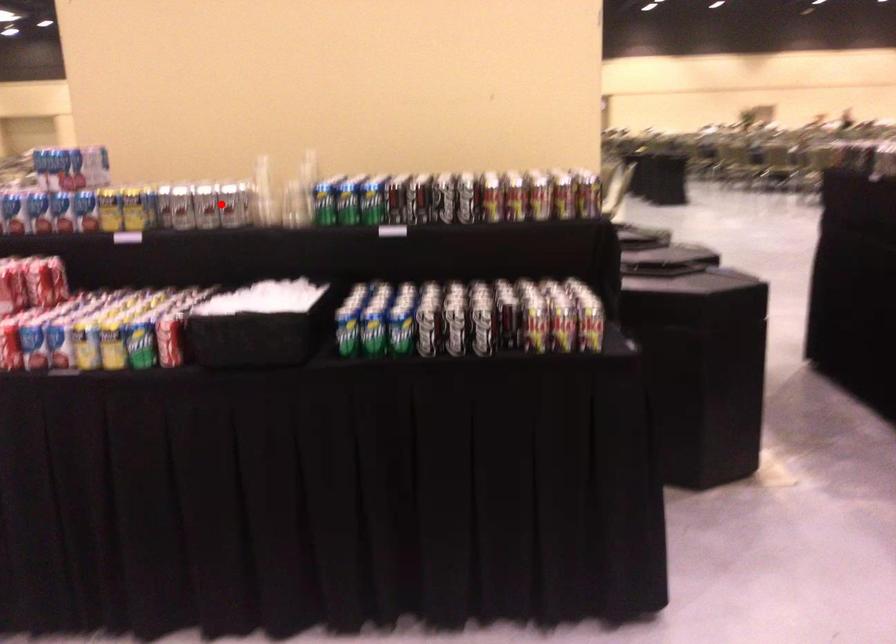
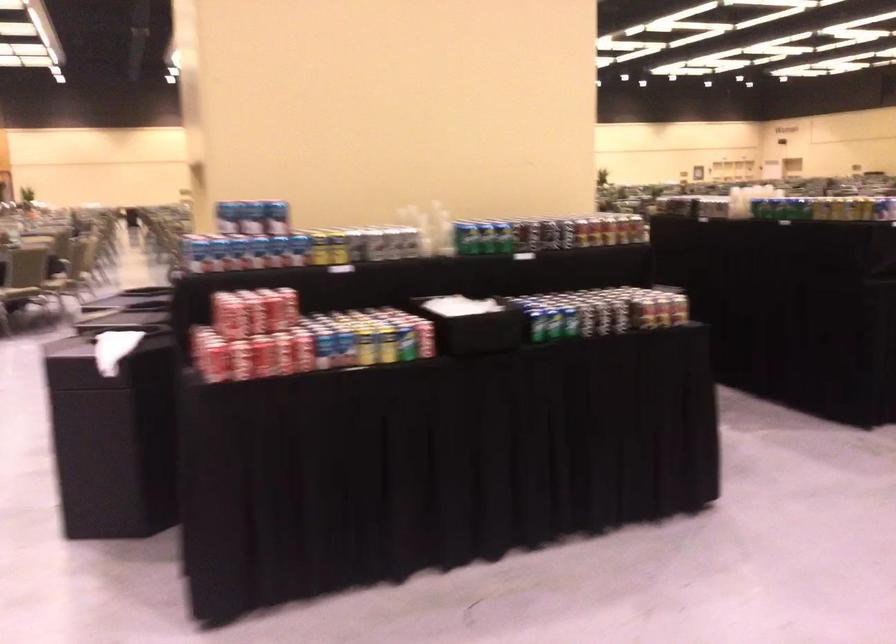
Locate, in the second image, the point that corresponds to the highlighted location in the first image.

(395, 242)